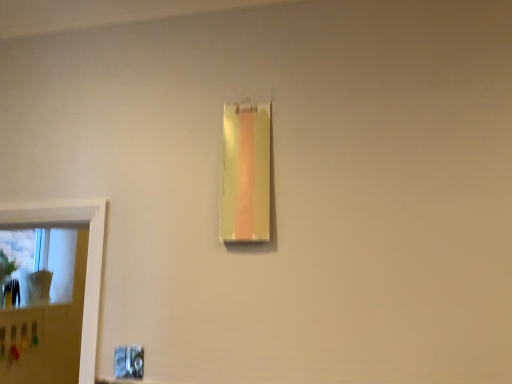
The image size is (512, 384). What do you see at coordinates (245, 173) in the screenshot?
I see `yellow matte paper at upper center` at bounding box center [245, 173].

I want to click on yellow matte paper at upper center, so click(x=245, y=173).

Locate an element on the screen. Image resolution: width=512 pixels, height=384 pixels. yellow matte paper at upper center is located at coordinates (245, 173).